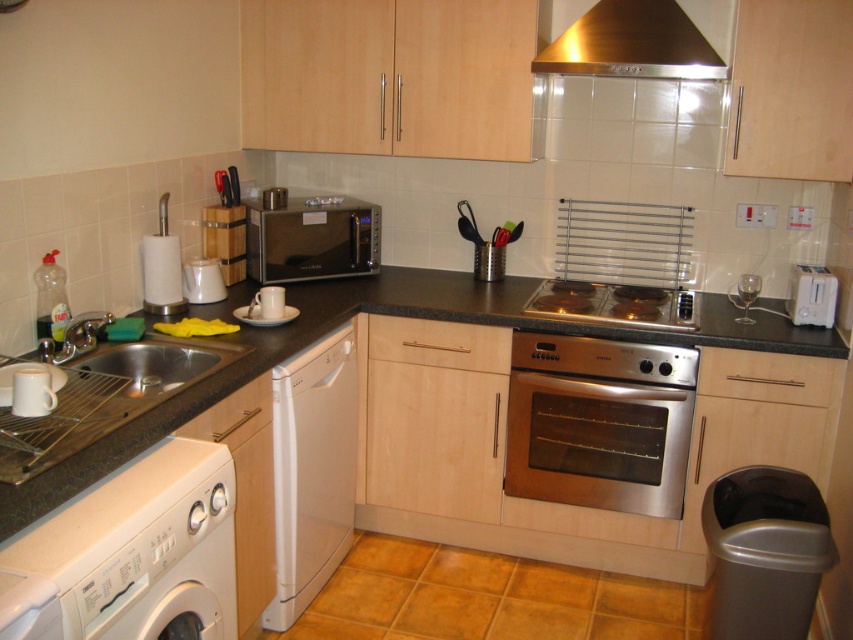
Is satin silver microwave at center wider than stainless steel sink at lower left?

Yes.

Who is lower down, satin silver microwave at center or stainless steel sink at lower left?

stainless steel sink at lower left

Between point (302, 218) and point (79, 369), which one is positioned in front?

Point (79, 369) is in front.

At what (x,y) coordinates should I click in order to perform the action: click on satin silver microwave at center. Please return your answer as a coordinate pair (x, y). Looking at the image, I should click on (311, 237).

Between white plastic washing machine at lower left and white plastic toaster at upper right, which one appears on the left side from the viewer's perspective?

From the viewer's perspective, white plastic washing machine at lower left appears more on the left side.

Is white plastic washing machine at lower left shorter than white plastic toaster at upper right?

No.

In order to click on white plastic washing machine at lower left in this screenshot , I will do `click(131, 554)`.

This screenshot has height=640, width=853. I want to click on white plastic washing machine at lower left, so click(131, 554).

Is point (310, 230) farther from viewer compared to point (662, 324)?

Yes, point (310, 230) is behind point (662, 324).

Does satin silver microwave at center appear under stainless steel electric stove at center?

Incorrect, satin silver microwave at center is not positioned below stainless steel electric stove at center.

Who is more distant from viewer, (366,260) or (589,316)?

Point (366,260)

This screenshot has width=853, height=640. I want to click on satin silver microwave at center, so click(311, 237).